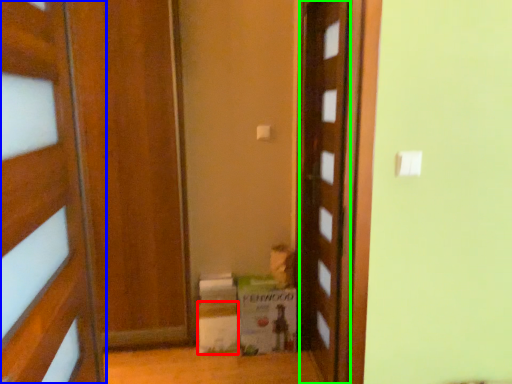
Question: Which is nearer to the cardboard box (highlighted by a red box)? door (highlighted by a blue box) or door (highlighted by a green box).

Choices:
 (A) door
 (B) door

Answer: (B)